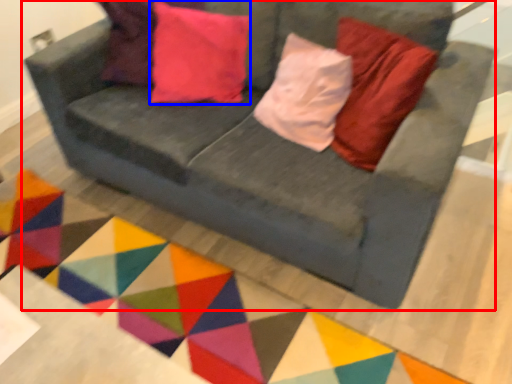
Question: Which point is closer to the camera, studio couch (highlighted by a red box) or pillow (highlighted by a blue box)?

Choices:
 (A) studio couch
 (B) pillow

Answer: (A)